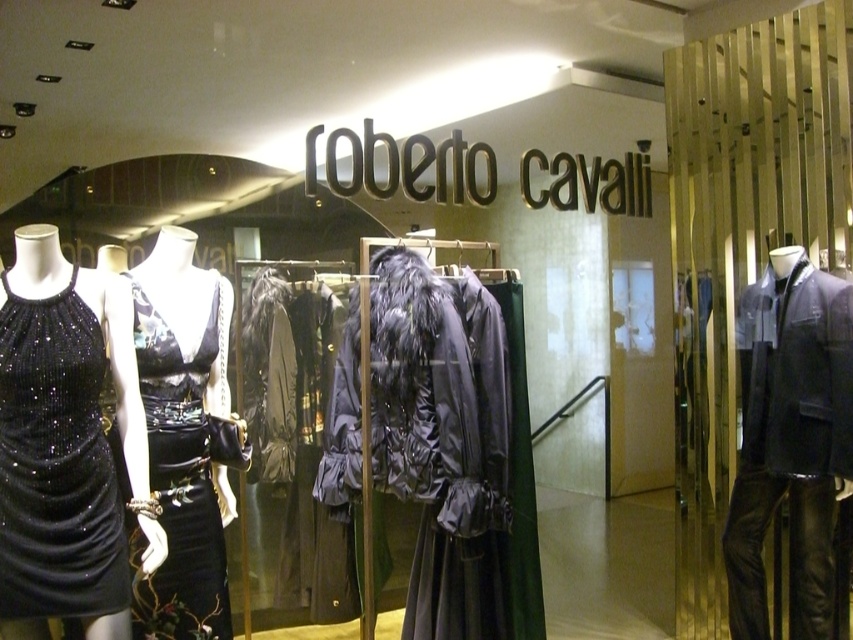
Question: Estimate the real-world distances between objects in this image. Which object is closer to the dark blue leather jacket at right?

Choices:
 (A) black sequined dress at left
 (B) black satin dress at center

Answer: (B)

Question: Which of the following is the farthest from the observer?

Choices:
 (A) (741, 515)
 (B) (163, 577)

Answer: (A)

Question: Estimate the real-world distances between objects in this image. Which object is farther from the dark blue leather jacket at right?

Choices:
 (A) black satin dress at center
 (B) black sequined dress at left

Answer: (B)

Question: Does black sequined dress at left have a smaller size compared to black satin dress at center?

Choices:
 (A) yes
 (B) no

Answer: (A)

Question: Can you confirm if black sequined dress at left is wider than black satin dress at center?

Choices:
 (A) yes
 (B) no

Answer: (B)

Question: Can you confirm if dark blue leather jacket at right is positioned above black sequined dress at left?

Choices:
 (A) yes
 (B) no

Answer: (B)